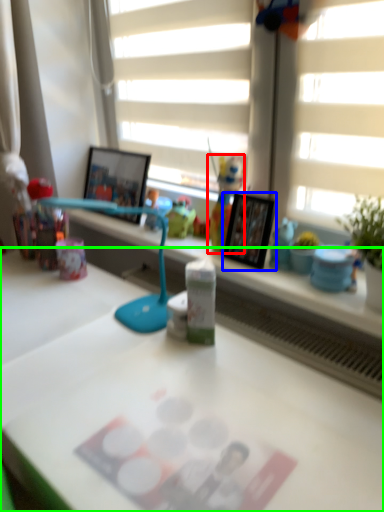
Question: Considering the real-world distances, which object is farthest from toy (highlighted by a red box)? picture frame (highlighted by a blue box) or desk (highlighted by a green box)?

Choices:
 (A) picture frame
 (B) desk

Answer: (B)